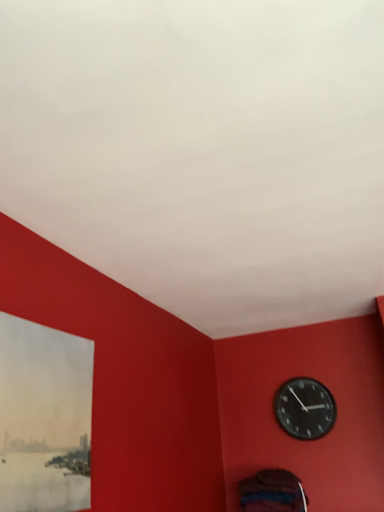
Question: Considering the positions of matte paper picture frame at lower left and black matte wall clock at upper right in the image, is matte paper picture frame at lower left taller or shorter than black matte wall clock at upper right?

Choices:
 (A) tall
 (B) short

Answer: (A)

Question: Is point (59, 408) closer or farther from the camera than point (329, 417)?

Choices:
 (A) farther
 (B) closer

Answer: (B)

Question: In terms of size, does matte paper picture frame at lower left appear bigger or smaller than black matte wall clock at upper right?

Choices:
 (A) small
 (B) big

Answer: (B)

Question: Considering the relative positions of black matte wall clock at upper right and matte paper picture frame at lower left in the image provided, is black matte wall clock at upper right to the left or to the right of matte paper picture frame at lower left?

Choices:
 (A) right
 (B) left

Answer: (A)

Question: Based on their sizes in the image, would you say black matte wall clock at upper right is bigger or smaller than matte paper picture frame at lower left?

Choices:
 (A) big
 (B) small

Answer: (B)

Question: In terms of height, does black matte wall clock at upper right look taller or shorter compared to matte paper picture frame at lower left?

Choices:
 (A) tall
 (B) short

Answer: (B)

Question: In terms of width, does black matte wall clock at upper right look wider or thinner when compared to matte paper picture frame at lower left?

Choices:
 (A) thin
 (B) wide

Answer: (B)